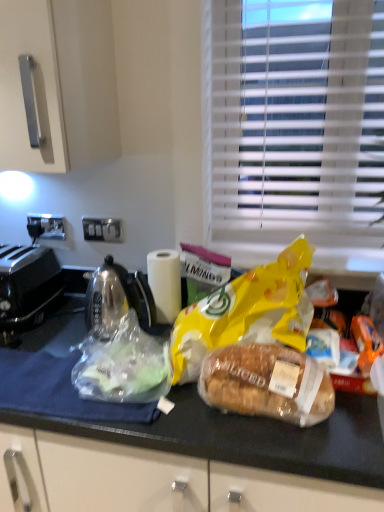
I want to click on vacant space underneath yellow plastic bag at upper center (from a real-world perspective), so pos(307,272).